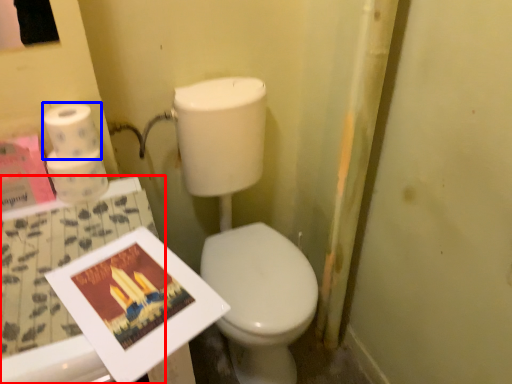
Question: Which point is closer to the camera, table (highlighted by a red box) or toilet paper (highlighted by a blue box)?

Choices:
 (A) table
 (B) toilet paper

Answer: (A)